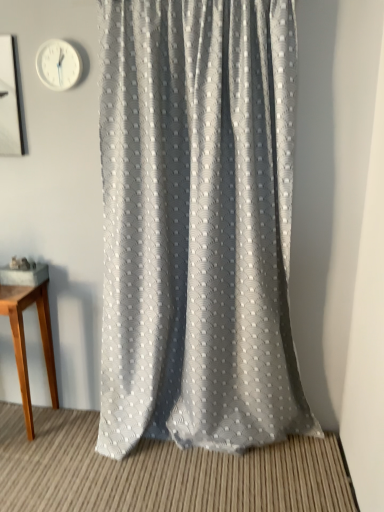
This screenshot has height=512, width=384. Describe the element at coordinates (198, 225) in the screenshot. I see `textured gray curtain at center` at that location.

This screenshot has height=512, width=384. Describe the element at coordinates (24, 340) in the screenshot. I see `light brown wooden table at left` at that location.

Measure the distance between point (44, 44) and camera.

The distance of point (44, 44) from camera is 1.83 meters.

The height and width of the screenshot is (512, 384). I want to click on textured gray curtain at center, so click(198, 225).

From the image's perspective, is white plastic clock at upper left located above or below textured gray curtain at center?

white plastic clock at upper left is above textured gray curtain at center.

Consider the image. Can you confirm if white plastic clock at upper left is bigger than textured gray curtain at center?

No.

Considering their positions, is white plastic clock at upper left located in front of or behind textured gray curtain at center?

white plastic clock at upper left is behind textured gray curtain at center.

Where is `clock that appears above the textured gray curtain at center (from a real-world perspective)`? clock that appears above the textured gray curtain at center (from a real-world perspective) is located at coordinates (58, 64).

In terms of size, does light brown wooden table at left appear bigger or smaller than textured gray curtain at center?

Clearly, light brown wooden table at left is smaller in size than textured gray curtain at center.

Is point (51, 351) closer or farther from the camera than point (178, 108)?

Point (51, 351) appears to be farther away from the viewer than point (178, 108).

Where is `table on the left side of textured gray curtain at center`? table on the left side of textured gray curtain at center is located at coordinates (24, 340).

What's the angular difference between white plastic clock at upper left and light brown wooden table at left's facing directions?

white plastic clock at upper left and light brown wooden table at left are facing 0.358 degrees away from each other.

From a real-world perspective, which is physically below, white plastic clock at upper left or light brown wooden table at left?

In real-world perspective, light brown wooden table at left is lower.

From the image's perspective, between white plastic clock at upper left and light brown wooden table at left, which one is located above?

white plastic clock at upper left.

From a real-world perspective, who is located lower, textured gray curtain at center or light brown wooden table at left?

In real-world perspective, light brown wooden table at left is lower.

Can you confirm if textured gray curtain at center is taller than light brown wooden table at left?

Yes, textured gray curtain at center is taller than light brown wooden table at left.

Is textured gray curtain at center not close to light brown wooden table at left?

No, textured gray curtain at center is not far away from light brown wooden table at left.

From the image's perspective, which one is positioned higher, textured gray curtain at center or white plastic clock at upper left?

white plastic clock at upper left.

From a real-world perspective, is textured gray curtain at center on top of white plastic clock at upper left?

No, from a real-world perspective, textured gray curtain at center is not above white plastic clock at upper left.

Which is behind, textured gray curtain at center or white plastic clock at upper left?

white plastic clock at upper left is behind.

Does light brown wooden table at left turn towards white plastic clock at upper left?

No, light brown wooden table at left is not facing towards white plastic clock at upper left.

From a real-world perspective, is light brown wooden table at left under white plastic clock at upper left?

Yes.

Relative to white plastic clock at upper left, is light brown wooden table at left in front or behind?

Clearly, light brown wooden table at left is behind white plastic clock at upper left.

Is light brown wooden table at left not inside white plastic clock at upper left?

Yes, light brown wooden table at left is outside of white plastic clock at upper left.

Identify the location of clock behind the textured gray curtain at center. (58, 64).

Image resolution: width=384 pixels, height=512 pixels. I want to click on curtain in front of the light brown wooden table at left, so click(198, 225).

Considering their positions, is white plastic clock at upper left positioned further to light brown wooden table at left than textured gray curtain at center?

white plastic clock at upper left is positioned further to the anchor light brown wooden table at left.

Based on their spatial positions, is textured gray curtain at center or light brown wooden table at left further from white plastic clock at upper left?

light brown wooden table at left is positioned further to the anchor white plastic clock at upper left.

Estimate the real-world distances between objects in this image. Which object is further from light brown wooden table at left, textured gray curtain at center or white plastic clock at upper left?

Among the two, white plastic clock at upper left is located further to light brown wooden table at left.

Based on their spatial positions, is white plastic clock at upper left or light brown wooden table at left closer to textured gray curtain at center?

The object closer to textured gray curtain at center is light brown wooden table at left.

Looking at the image, which one is located closer to white plastic clock at upper left, light brown wooden table at left or textured gray curtain at center?

textured gray curtain at center is closer to white plastic clock at upper left.

When comparing their distances from textured gray curtain at center, does light brown wooden table at left or white plastic clock at upper left seem further?

white plastic clock at upper left is positioned further to the anchor textured gray curtain at center.

Find the location of a particular element. curtain that lies between white plastic clock at upper left and light brown wooden table at left from top to bottom is located at coordinates (198, 225).